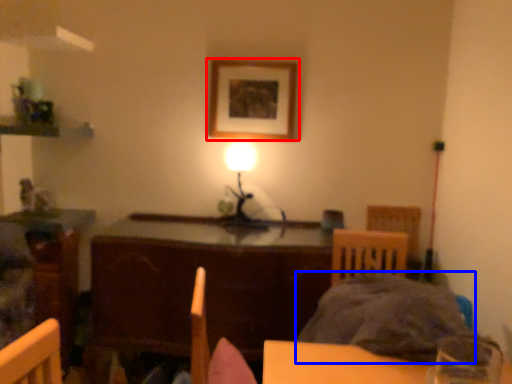
Question: Which object appears closest to the camera in this image, picture frame (highlighted by a red box) or bedding (highlighted by a blue box)?

Choices:
 (A) picture frame
 (B) bedding

Answer: (B)